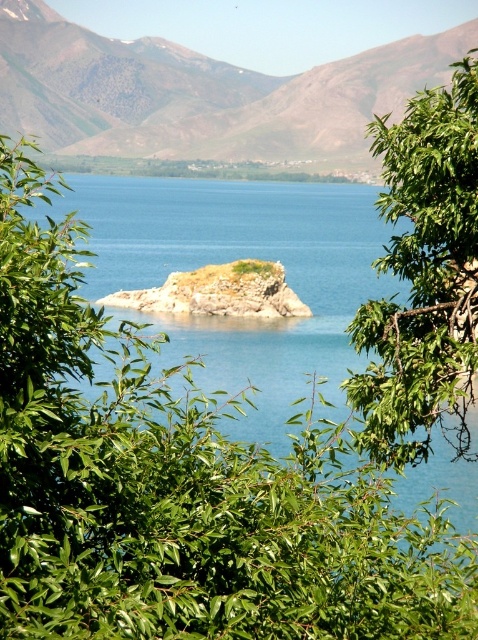
You are an artist planning to paint this scene. You want to ensure the blue smooth water at center and the green leafy branch at upper right are proportionally accurate. Which object should you paint first to maintain scale, and why?

You should paint the blue smooth water at center first because it is larger than the green leafy branch at upper right, so starting with the bigger area ensures proper scaling for the smaller element.

You are a bird flying over the serene natural landscape. You see the green leafy branch at upper right. Can you determine its exact location in the image using coordinates?

The green leafy branch at upper right is located at point (423, 276).